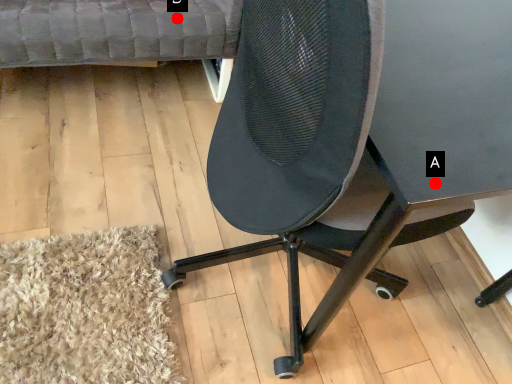
Question: Two points are circled on the image, labeled by A and B beside each circle. Which point is closer to the camera?

Choices:
 (A) A is closer
 (B) B is closer

Answer: (A)